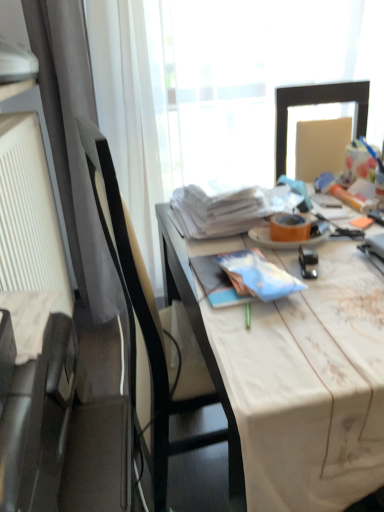
You are a GUI agent. You are given a task and a screenshot of the screen. Output one action in this format:
    pyautogui.click(x=<x>, y=<y>)
    Task: Click on the vacant area that lies between orange matte plate at center and metallic black stapler at center-right
    This screenshot has height=512, width=384.
    Given the screenshot: What is the action you would take?
    306,260